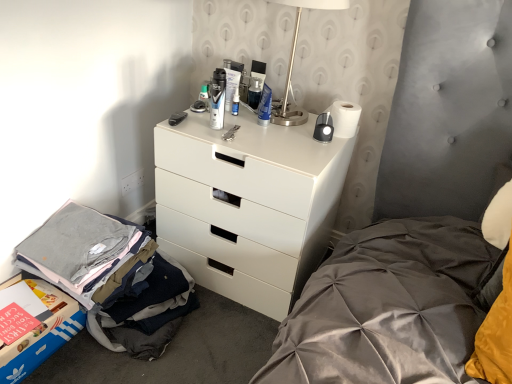
Question: Is gray cotton t-shirts at lower left facing away from matte black shaving cream can at center, acting as the 4th toiletry starting from the right?

Choices:
 (A) yes
 (B) no

Answer: (B)

Question: Does gray cotton t-shirts at lower left have a larger size compared to matte black shaving cream can at center, acting as the 4th toiletry starting from the right?

Choices:
 (A) no
 (B) yes

Answer: (B)

Question: Can you confirm if gray cotton t-shirts at lower left is taller than matte black shaving cream can at center, acting as the 4th toiletry starting from the right?

Choices:
 (A) no
 (B) yes

Answer: (A)

Question: Is matte black shaving cream can at center, acting as the 4th toiletry starting from the right, inside gray cotton t-shirts at lower left?

Choices:
 (A) no
 (B) yes

Answer: (A)

Question: Considering the relative positions of gray cotton t-shirts at lower left and matte black shaving cream can at center, marked as the second toiletry in a left-to-right arrangement, in the image provided, is gray cotton t-shirts at lower left to the right of matte black shaving cream can at center, marked as the second toiletry in a left-to-right arrangement, from the viewer's perspective?

Choices:
 (A) no
 (B) yes

Answer: (A)

Question: Can you see gray cotton t-shirts at lower left touching matte black shaving cream can at center, marked as the second toiletry in a left-to-right arrangement?

Choices:
 (A) no
 (B) yes

Answer: (A)

Question: Would you consider blue cardboard storage box at lower left to be distant from satin silver table lamp at upper right?

Choices:
 (A) yes
 (B) no

Answer: (A)

Question: Is blue cardboard storage box at lower left behind satin silver table lamp at upper right?

Choices:
 (A) no
 (B) yes

Answer: (A)

Question: Does blue cardboard storage box at lower left lie in front of satin silver table lamp at upper right?

Choices:
 (A) yes
 (B) no

Answer: (A)

Question: Can you see blue cardboard storage box at lower left touching satin silver table lamp at upper right?

Choices:
 (A) no
 (B) yes

Answer: (A)

Question: From the image's perspective, is blue cardboard storage box at lower left under satin silver table lamp at upper right?

Choices:
 (A) yes
 (B) no

Answer: (A)

Question: Considering the relative sizes of blue cardboard storage box at lower left and satin silver table lamp at upper right in the image provided, is blue cardboard storage box at lower left smaller than satin silver table lamp at upper right?

Choices:
 (A) no
 (B) yes

Answer: (B)

Question: Does translucent plastic bottle at upper center, the 1th toiletry from the left, have a greater width compared to white plastic outlet at lower left?

Choices:
 (A) yes
 (B) no

Answer: (A)